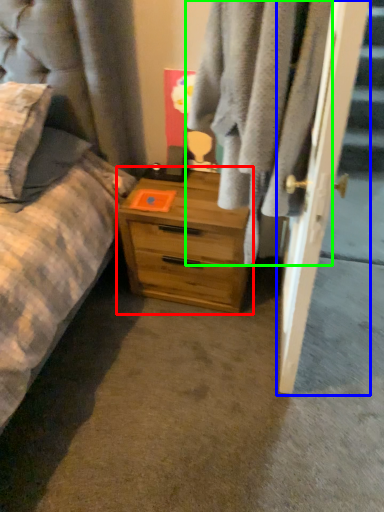
Question: Which object is the farthest from chest of drawers (highlighted by a red box)? Choose among these: door (highlighted by a blue box) or clothing (highlighted by a green box).

Choices:
 (A) door
 (B) clothing

Answer: (A)